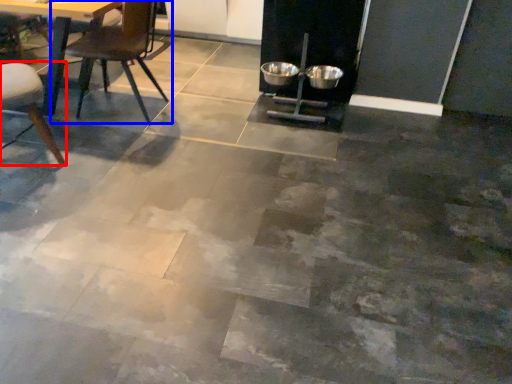
Question: Which object appears farthest to the camera in this image, chair (highlighted by a red box) or chair (highlighted by a blue box)?

Choices:
 (A) chair
 (B) chair

Answer: (B)